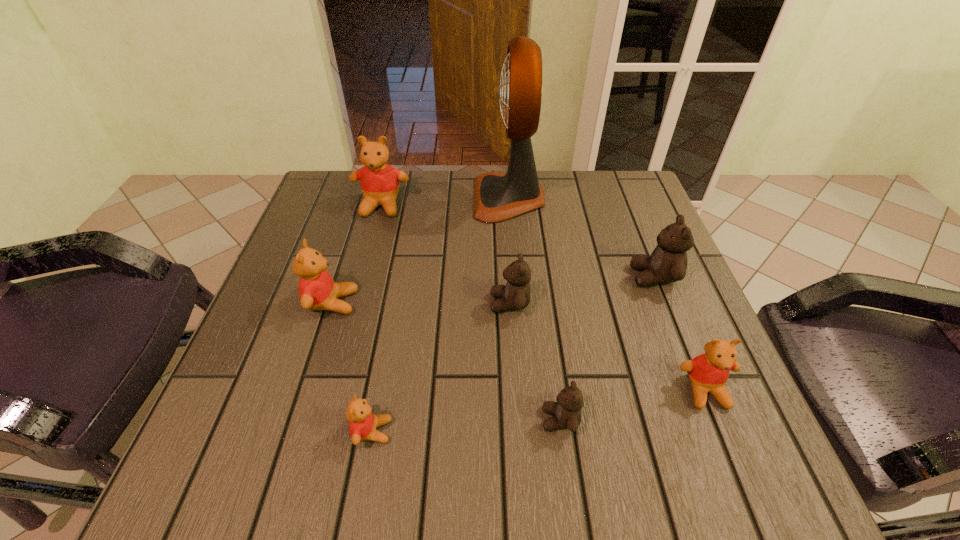
You are a GUI agent. You are given a task and a screenshot of the screen. Output one action in this format:
    pyautogui.click(x=<x>, y=<y>)
    Task: Click on the brown fan
    The image size is (960, 540).
    Given the screenshot: What is the action you would take?
    pyautogui.click(x=497, y=197)

At what (x,y) coordinates should I click in order to perform the action: click on the tallest object. Please return your answer as a coordinate pair (x, y). This screenshot has width=960, height=540. Looking at the image, I should click on (497, 197).

Find the location of `the biggest red teddy bear`. the biggest red teddy bear is located at coordinates (379, 181).

Where is `the tallest teddy bear`? the tallest teddy bear is located at coordinates (379, 181).

Locate an element on the screen. The image size is (960, 540). the rightmost brown teddy bear is located at coordinates (668, 262).

Locate an element on the screen. The width and height of the screenshot is (960, 540). the third smallest red teddy bear is located at coordinates (317, 290).

Where is `the fourth teddy bear from right to left`? This screenshot has height=540, width=960. the fourth teddy bear from right to left is located at coordinates (515, 294).

Image resolution: width=960 pixels, height=540 pixels. In order to click on the leftmost brown teddy bear in this screenshot , I will do `click(515, 294)`.

At what (x,y) coordinates should I click in order to perform the action: click on the third biggest red teddy bear. Please return your answer as a coordinate pair (x, y). The height and width of the screenshot is (540, 960). Looking at the image, I should click on (708, 372).

I want to click on the fifth teddy bear from left to right, so click(x=566, y=412).